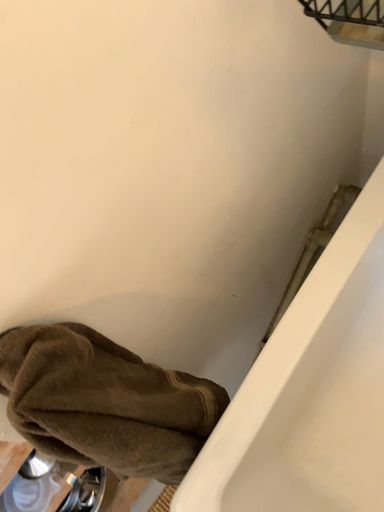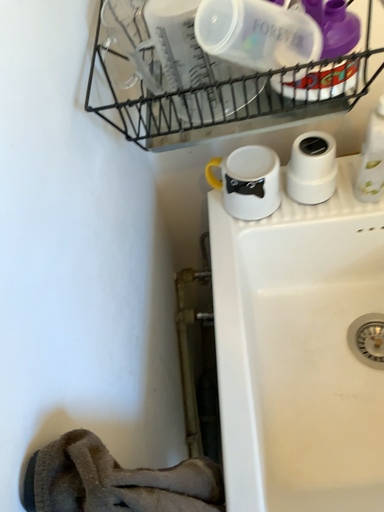
Question: Which way did the camera rotate in the video?

Choices:
 (A) rotated upward
 (B) rotated downward

Answer: (A)